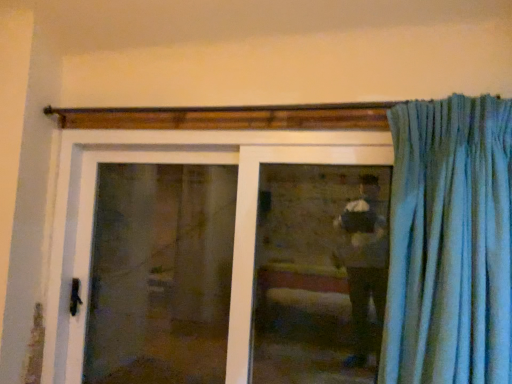
Find the location of a particular element. Image resolution: width=512 pixels, height=384 pixels. empty space that is ontop of clear glass window at center (from a real-world perspective) is located at coordinates (322, 144).